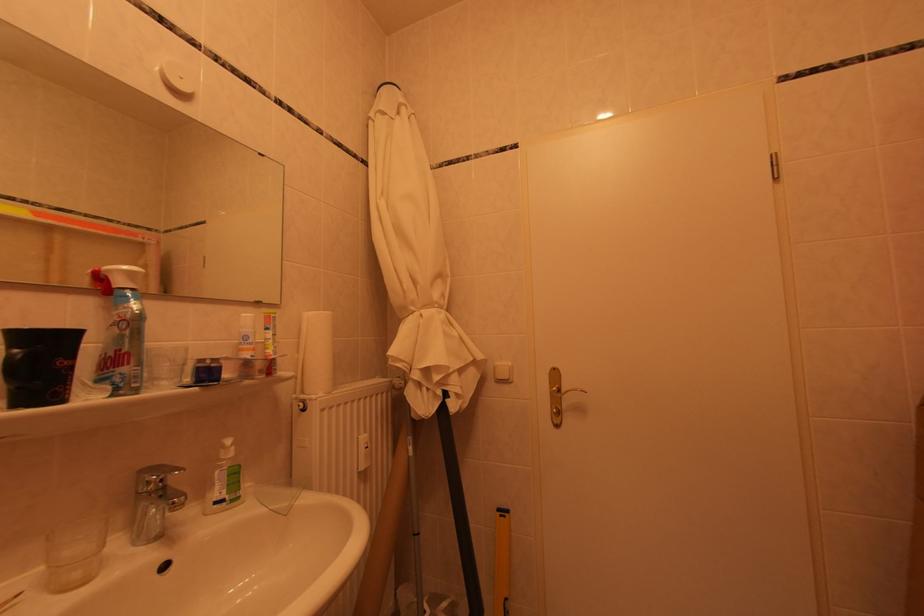
The height and width of the screenshot is (616, 924). In order to click on golden door handle in this screenshot , I will do `click(576, 408)`.